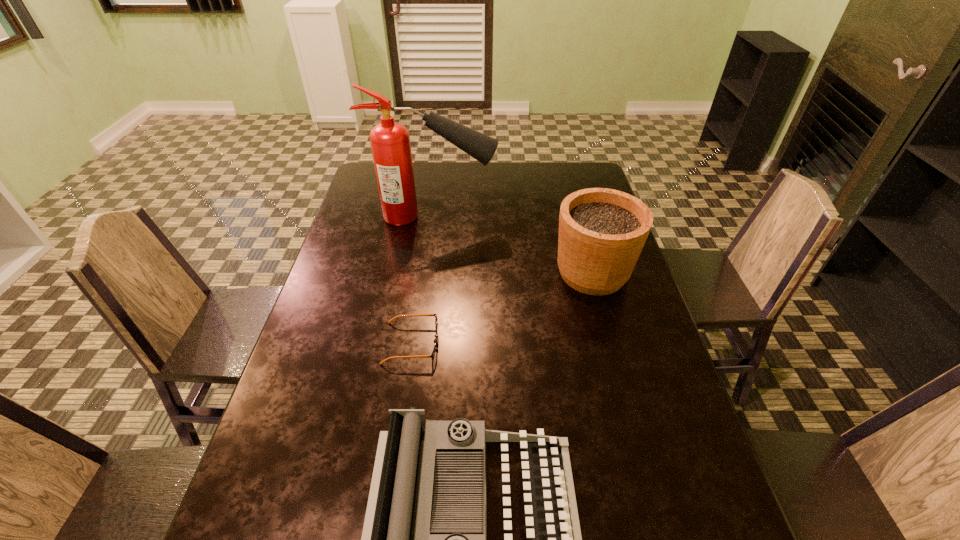
The width and height of the screenshot is (960, 540). I want to click on object at the right edge, so click(x=602, y=232).

Locate an element on the screen. Image resolution: width=960 pixels, height=540 pixels. vacant space at the far edge of the desktop is located at coordinates (468, 189).

Identify the location of vacant space at the left edge of the desktop. (376, 197).

In the image, there is a desktop. Where is `free region at the right edge`? free region at the right edge is located at coordinates (686, 516).

You are a GUI agent. You are given a task and a screenshot of the screen. Output one action in this format:
    pyautogui.click(x=<x>, y=<y>)
    Task: Click on the vacant space at the far left corner of the desktop
    
    Given the screenshot: What is the action you would take?
    pyautogui.click(x=374, y=193)

Where is `free space between the spectacles and the fire extinguisher`? free space between the spectacles and the fire extinguisher is located at coordinates (422, 280).

The image size is (960, 540). I want to click on free spot between the rightmost object and the spectacles, so click(x=502, y=308).

Locate an element on the screen. The height and width of the screenshot is (540, 960). object that stands as the third closest to the shortest object is located at coordinates (390, 141).

Identify which object is the third nearest to the second farthest object. Please provide its 2D coordinates. Your answer should be formatted as a tuple, i.e. [(x, y)], where the tuple contains the x and y coordinates of a point satisfying the conditions above.

[(396, 539)]

At what (x,y) coordinates should I click in order to perform the action: click on vacant space that satisfies the following two spatial constraints: 1. at the nozzle of the farthest object; 2. on the right side of the rightmost object. Please return your answer as a coordinate pair (x, y). Looking at the image, I should click on (426, 273).